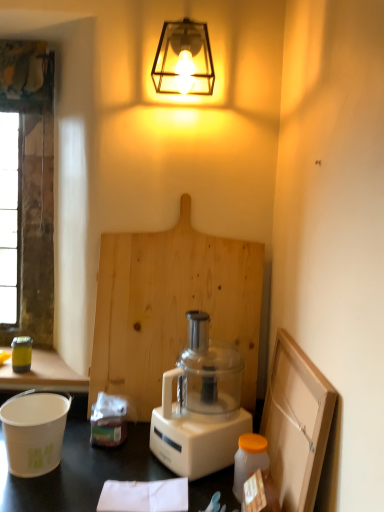
Question: Is white matte bucket at lower left, the second appliance from the back, to the left or to the right of metallic yellow canister at left, acting as the first appliance starting from the back, in the image?

Choices:
 (A) right
 (B) left

Answer: (A)

Question: Is white matte bucket at lower left, placed as the 1th appliance when sorted from front to back, taller or shorter than metallic yellow canister at left, placed as the 2th appliance when sorted from bottom to top?

Choices:
 (A) tall
 (B) short

Answer: (A)

Question: Based on their relative distances, which object is nearer to the white plastic blender at center?

Choices:
 (A) white matte bucket at lower left, placed as the 1th appliance when sorted from right to left
 (B) metallic cage at upper center
 (C) translucent plastic bag at lower left
 (D) glass window screen at left
 (E) metallic yellow canister at left, acting as the first appliance starting from the back

Answer: (C)

Question: Which object is positioned farthest from the translucent plastic bag at lower left?

Choices:
 (A) white plastic blender at center
 (B) translucent plastic jar at lower right
 (C) natural wood cutting board at center
 (D) metallic cage at upper center
 (E) metallic yellow canister at left, placed as the 2th appliance when sorted from bottom to top

Answer: (D)